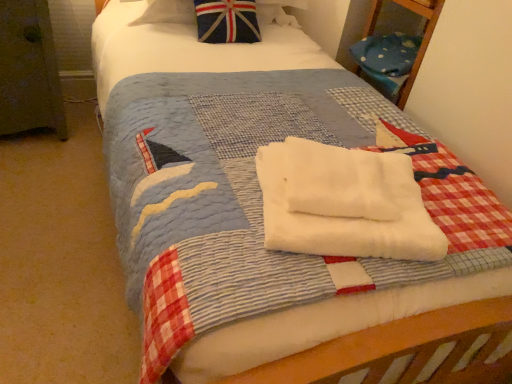
Question: Is white soft towel at center, which is the second beach towel from top to bottom, not close to white soft towel at center, the 2th beach towel in the bottom-to-top sequence?

Choices:
 (A) no
 (B) yes

Answer: (A)

Question: Is white soft towel at center, which is the second beach towel from top to bottom, outside white soft towel at center, the 2th beach towel in the bottom-to-top sequence?

Choices:
 (A) no
 (B) yes

Answer: (A)

Question: Can you confirm if white soft towel at center, which is the second beach towel from top to bottom, is positioned to the right of white soft towel at center, the 2th beach towel in the bottom-to-top sequence?

Choices:
 (A) yes
 (B) no

Answer: (A)

Question: Is white soft towel at center, the 2th beach towel in the bottom-to-top sequence, at the back of white soft towel at center, which is the second beach towel from top to bottom?

Choices:
 (A) no
 (B) yes

Answer: (B)

Question: Does white soft towel at center, the first beach towel ordered from the bottom, lie behind white soft towel at center, the 2th beach towel in the bottom-to-top sequence?

Choices:
 (A) yes
 (B) no

Answer: (B)

Question: Considering the positions of white soft towel at center, the first beach towel ordered from the bottom, and union jack fabric pillow at upper center in the image, is white soft towel at center, the first beach towel ordered from the bottom, bigger or smaller than union jack fabric pillow at upper center?

Choices:
 (A) small
 (B) big

Answer: (A)

Question: From a real-world perspective, relative to union jack fabric pillow at upper center, is white soft towel at center, the first beach towel ordered from the bottom, vertically above or below?

Choices:
 (A) below
 (B) above

Answer: (A)

Question: Looking at their shapes, would you say white soft towel at center, the first beach towel ordered from the bottom, is wider or thinner than union jack fabric pillow at upper center?

Choices:
 (A) wide
 (B) thin

Answer: (B)

Question: Is point (289, 231) closer or farther from the camera than point (131, 21)?

Choices:
 (A) farther
 (B) closer

Answer: (B)

Question: In terms of height, does white soft towel at center, which is the second beach towel from top to bottom, look taller or shorter compared to white soft towel at center, which is counted as the first beach towel, starting from the top?

Choices:
 (A) tall
 (B) short

Answer: (B)

Question: Considering their positions, is white soft towel at center, which is the second beach towel from top to bottom, located in front of or behind white soft towel at center, the 2th beach towel in the bottom-to-top sequence?

Choices:
 (A) behind
 (B) front

Answer: (B)

Question: Is white soft towel at center, the first beach towel ordered from the bottom, situated inside white soft towel at center, which is counted as the first beach towel, starting from the top, or outside?

Choices:
 (A) inside
 (B) outside

Answer: (A)

Question: In terms of width, does white soft towel at center, the first beach towel ordered from the bottom, look wider or thinner when compared to white soft towel at center, the 2th beach towel in the bottom-to-top sequence?

Choices:
 (A) thin
 (B) wide

Answer: (B)

Question: In the image, is white soft towel at center, the 2th beach towel in the bottom-to-top sequence, on the left side or the right side of white soft towel at center, the first beach towel ordered from the bottom?

Choices:
 (A) right
 (B) left

Answer: (B)

Question: Considering the positions of white soft towel at center, the 2th beach towel in the bottom-to-top sequence, and white soft towel at center, which is the second beach towel from top to bottom, in the image, is white soft towel at center, the 2th beach towel in the bottom-to-top sequence, bigger or smaller than white soft towel at center, which is the second beach towel from top to bottom,?

Choices:
 (A) big
 (B) small

Answer: (B)